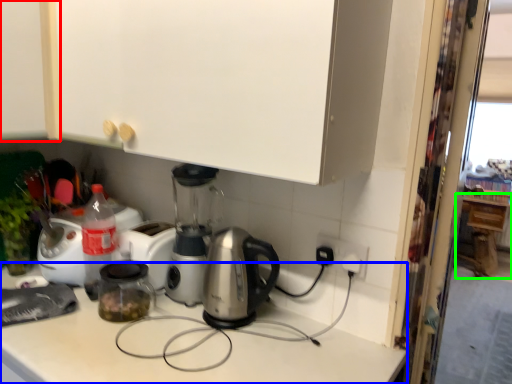
Question: Which is nearer to the cabinetry (highlighted by a red box)? counter top (highlighted by a blue box) or cabinetry (highlighted by a green box).

Choices:
 (A) counter top
 (B) cabinetry

Answer: (A)